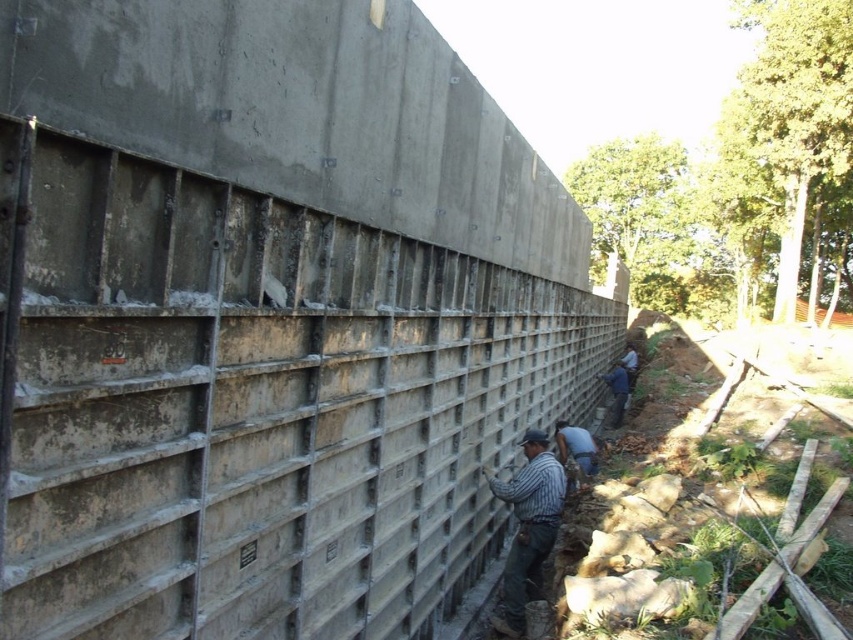
Does point (76, 529) come farther from viewer compared to point (590, 451)?

No, (76, 529) is in front of (590, 451).

Is point (175, 237) closer to viewer compared to point (590, 458)?

That is True.

Identify the location of concrete wall at left. Image resolution: width=853 pixels, height=640 pixels. (253, 404).

Is concrete wall at left above blue denim shirt at lower right?

Yes.

Is concrete wall at left below blue denim shirt at lower right?

Incorrect, concrete wall at left is not positioned below blue denim shirt at lower right.

Is point (235, 540) positioned before point (601, 374)?

Yes, it is in front of point (601, 374).

This screenshot has width=853, height=640. I want to click on concrete wall at left, so click(253, 404).

Does blue jeans at lower right have a smaller size compared to blue denim shirt at lower right?

Yes.

Is blue jeans at lower right wider than blue denim shirt at lower right?

Correct, the width of blue jeans at lower right exceeds that of blue denim shirt at lower right.

Who is more distant from viewer, (567, 426) or (612, 417)?

Point (612, 417)

This screenshot has width=853, height=640. In order to click on blue jeans at lower right in this screenshot , I will do `click(576, 448)`.